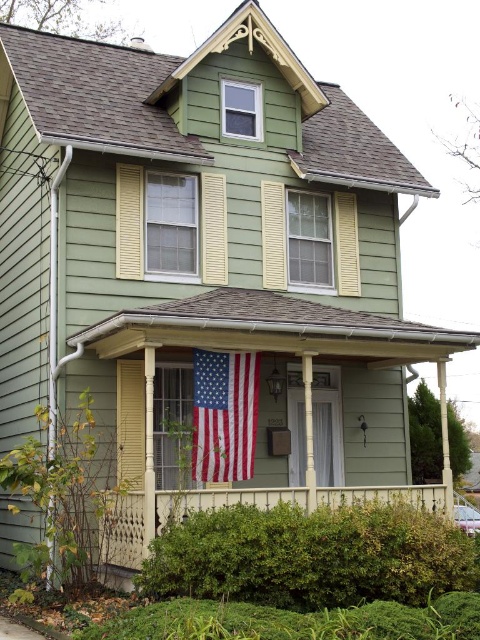
Question: Considering the real-world distances, which object is farthest from the american flag at center?

Choices:
 (A) white painted wood porch at lower center
 (B) matte green porch at center

Answer: (A)

Question: From the image, what is the correct spatial relationship of white painted wood porch at lower center in relation to american flag at center?

Choices:
 (A) below
 (B) above

Answer: (A)

Question: Estimate the real-world distances between objects in this image. Which object is farther from the american flag at center?

Choices:
 (A) matte green porch at center
 (B) white painted wood porch at lower center

Answer: (B)

Question: Does white painted wood porch at lower center have a greater width compared to american flag at center?

Choices:
 (A) yes
 (B) no

Answer: (A)

Question: Which point is farther from the camera taking this photo?

Choices:
 (A) (116, 312)
 (B) (123, 545)

Answer: (A)

Question: Does white painted wood porch at lower center have a smaller size compared to american flag at center?

Choices:
 (A) yes
 (B) no

Answer: (B)